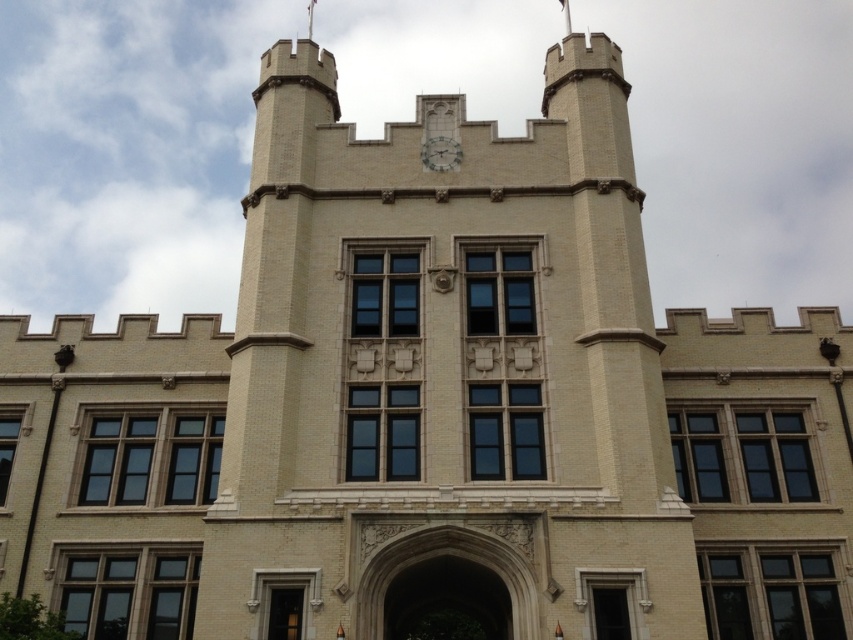
Question: Which of the following is the closest to the observer?

Choices:
 (A) white brick tower at center
 (B) white glossy clock at center

Answer: (A)

Question: Which point appears farthest from the camera in this image?

Choices:
 (A) (402, 284)
 (B) (456, 147)
 (C) (315, 1)

Answer: (C)

Question: From the image, what is the correct spatial relationship of white brick tower at center in relation to white fabric flag at upper center?

Choices:
 (A) below
 (B) above

Answer: (A)

Question: Which point is closer to the camera?

Choices:
 (A) (311, 3)
 (B) (433, 166)
 (C) (592, 246)

Answer: (C)

Question: Does white brick tower at center have a larger size compared to white fabric flag at upper center?

Choices:
 (A) no
 (B) yes

Answer: (B)

Question: Can you confirm if white glossy clock at center is smaller than white fabric flag at upper center?

Choices:
 (A) no
 (B) yes

Answer: (A)